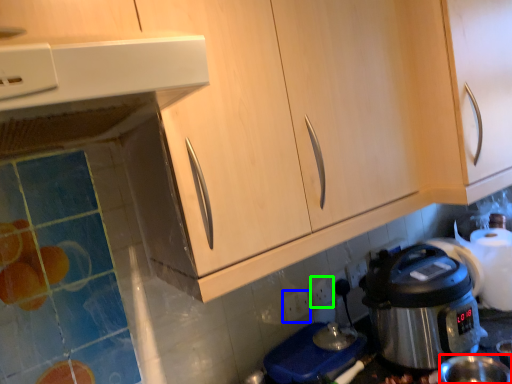
Question: Considering the real-world distances, which object is closest to coffee cup (highlighted by a red box)? power outlet (highlighted by a blue box) or electric outlet (highlighted by a green box).

Choices:
 (A) power outlet
 (B) electric outlet

Answer: (B)